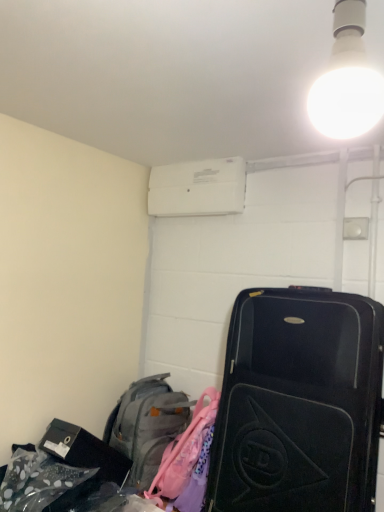
Question: Considering the relative sizes of white glossy bulb at upper right and black hardshell suitcase at right in the image provided, is white glossy bulb at upper right bigger than black hardshell suitcase at right?

Choices:
 (A) no
 (B) yes

Answer: (A)

Question: Is the depth of white glossy bulb at upper right less than that of black hardshell suitcase at right?

Choices:
 (A) no
 (B) yes

Answer: (B)

Question: Is white glossy bulb at upper right behind black hardshell suitcase at right?

Choices:
 (A) no
 (B) yes

Answer: (A)

Question: Is white glossy bulb at upper right touching black hardshell suitcase at right?

Choices:
 (A) yes
 (B) no

Answer: (B)

Question: From a real-world perspective, is white glossy bulb at upper right below black hardshell suitcase at right?

Choices:
 (A) yes
 (B) no

Answer: (B)

Question: Based on their sizes in the image, would you say gray fabric backpack at lower left is bigger or smaller than white plastic air conditioner at upper center?

Choices:
 (A) big
 (B) small

Answer: (A)

Question: Is point (147, 426) closer or farther from the camera than point (150, 195)?

Choices:
 (A) closer
 (B) farther

Answer: (A)

Question: Would you say gray fabric backpack at lower left is to the left or to the right of white plastic air conditioner at upper center in the picture?

Choices:
 (A) left
 (B) right

Answer: (A)

Question: From a real-world perspective, is gray fabric backpack at lower left above or below white plastic air conditioner at upper center?

Choices:
 (A) above
 (B) below

Answer: (B)

Question: Considering the positions of white plastic air conditioner at upper center and black hardshell suitcase at right in the image, is white plastic air conditioner at upper center taller or shorter than black hardshell suitcase at right?

Choices:
 (A) tall
 (B) short

Answer: (B)

Question: In terms of size, does white plastic air conditioner at upper center appear bigger or smaller than black hardshell suitcase at right?

Choices:
 (A) big
 (B) small

Answer: (B)

Question: Is white plastic air conditioner at upper center in front of or behind black hardshell suitcase at right in the image?

Choices:
 (A) behind
 (B) front

Answer: (A)

Question: In terms of width, does white plastic air conditioner at upper center look wider or thinner when compared to black hardshell suitcase at right?

Choices:
 (A) wide
 (B) thin

Answer: (B)

Question: From their relative heights in the image, would you say white plastic air conditioner at upper center is taller or shorter than gray fabric backpack at lower left?

Choices:
 (A) short
 (B) tall

Answer: (A)

Question: In the image, is white plastic air conditioner at upper center on the left side or the right side of gray fabric backpack at lower left?

Choices:
 (A) left
 (B) right

Answer: (B)